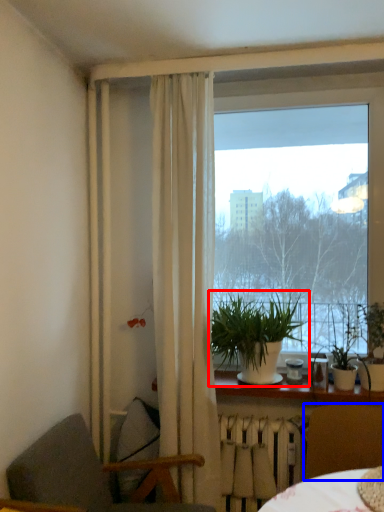
Question: Among these objects, which one is farthest to the camera, houseplant (highlighted by a red box) or chair (highlighted by a blue box)?

Choices:
 (A) houseplant
 (B) chair

Answer: (A)